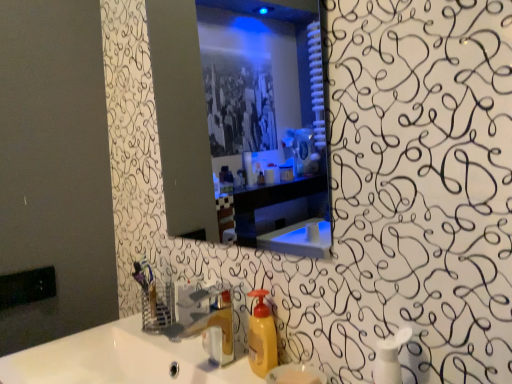
Measure the distance between point [28,359] and camera.

38.15 inches.

The height and width of the screenshot is (384, 512). What do you see at coordinates (120, 360) in the screenshot?
I see `white glossy sink at center` at bounding box center [120, 360].

The height and width of the screenshot is (384, 512). In order to click on white glossy sink at center in this screenshot , I will do `click(120, 360)`.

Where is `white glossy sink at center`? white glossy sink at center is located at coordinates (120, 360).